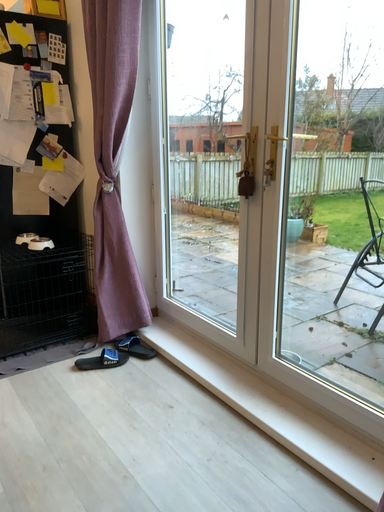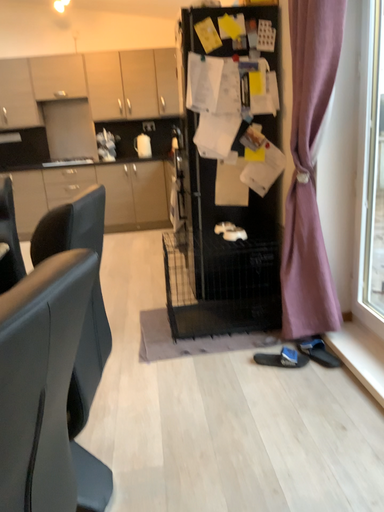
Question: Which way did the camera rotate in the video?

Choices:
 (A) rotated right
 (B) rotated left

Answer: (B)